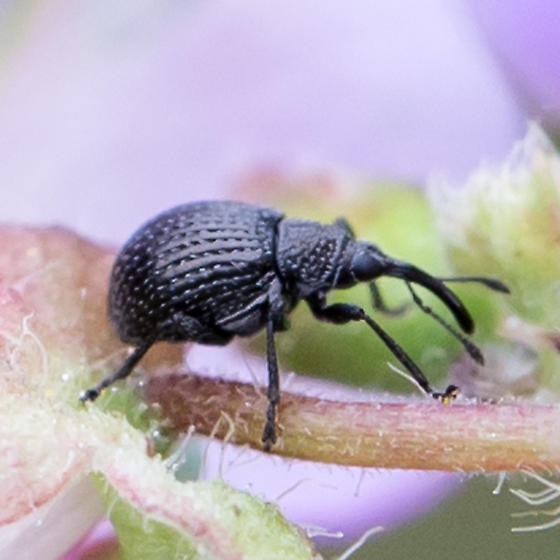
This screenshot has width=560, height=560. In order to click on plant in this screenshot , I will do `click(149, 494)`, `click(53, 389)`, `click(214, 400)`, `click(362, 438)`.